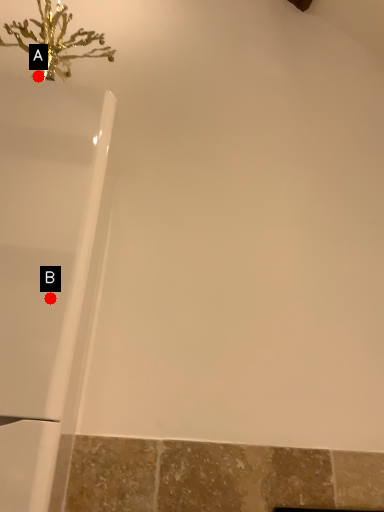
Question: Two points are circled on the image, labeled by A and B beside each circle. Among these points, which one is farthest from the camera?

Choices:
 (A) A is further
 (B) B is further

Answer: (A)